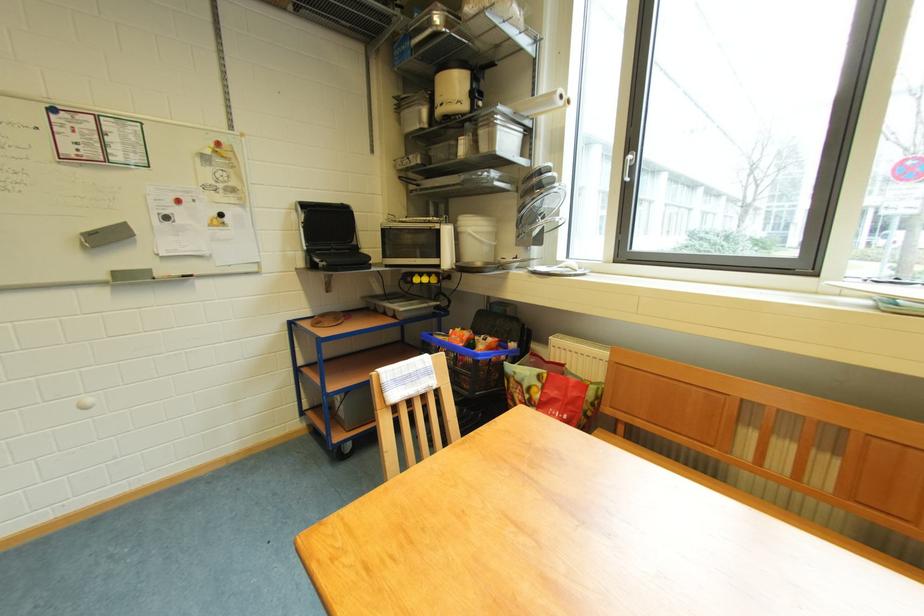
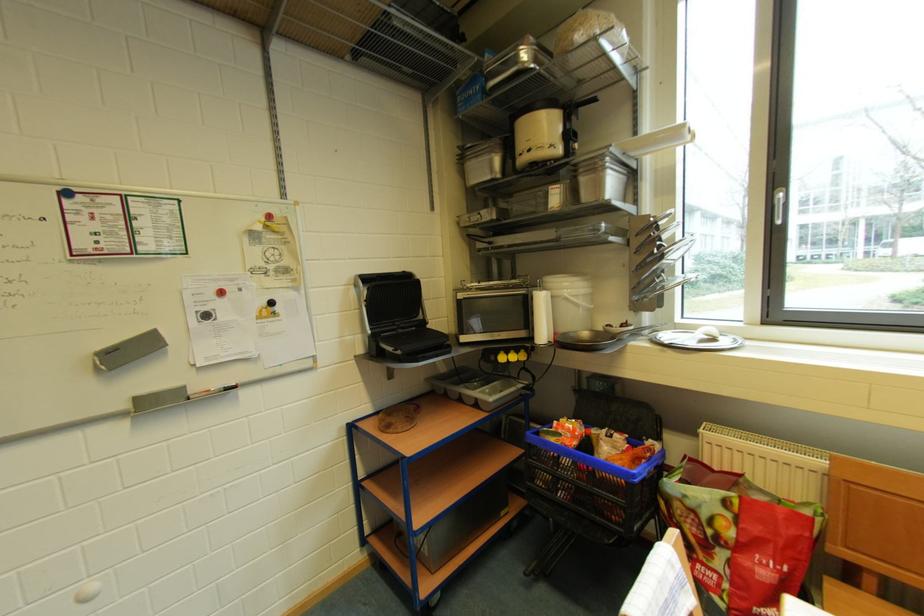
Locate, in the second image, the point that corresponds to (417,282) in the first image.

(500, 361)